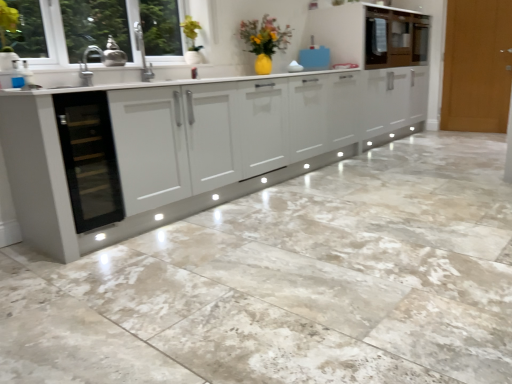
The image size is (512, 384). I want to click on free space in front of light brown wooden door at right, so click(x=475, y=137).